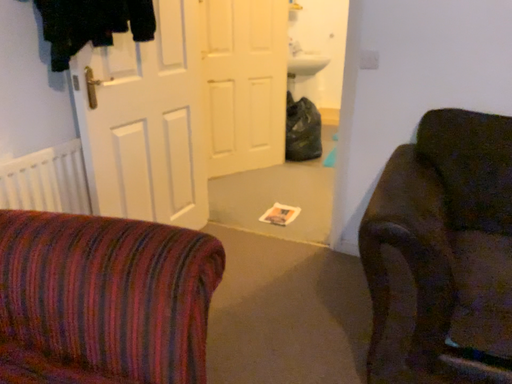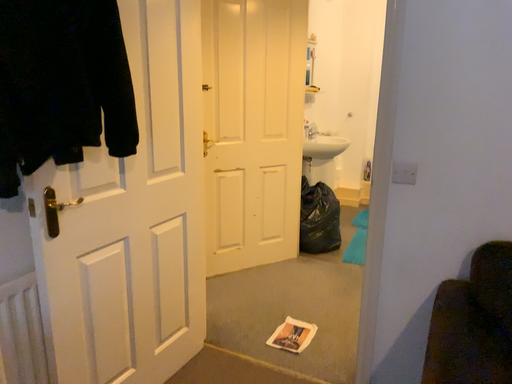
Question: How did the camera likely rotate when shooting the video?

Choices:
 (A) rotated upward
 (B) rotated downward

Answer: (A)